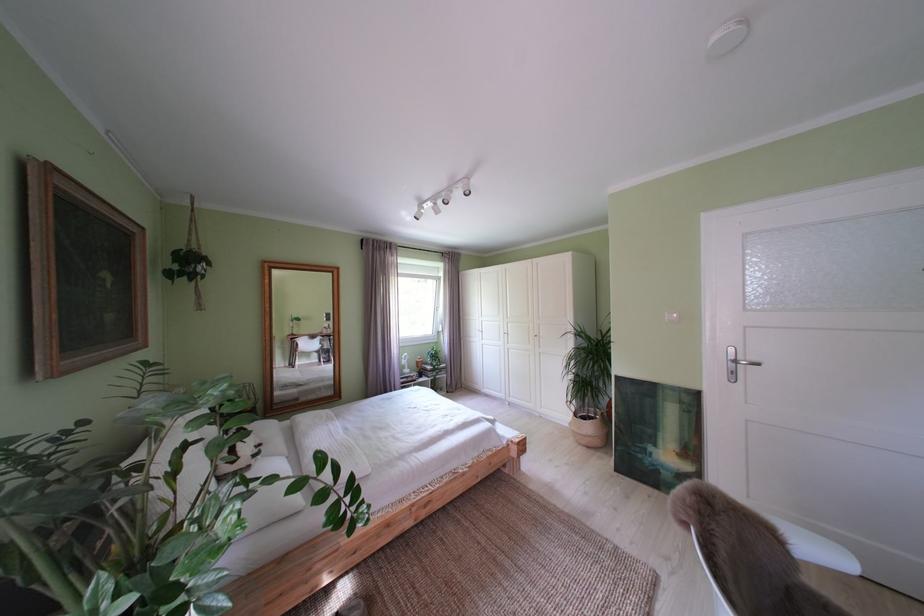
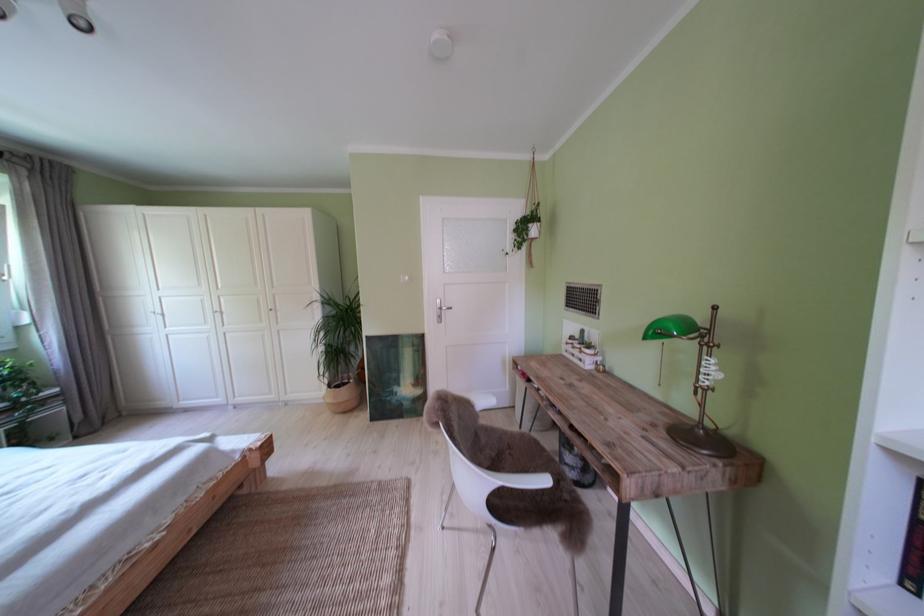
Where in the second image is the point corresponding to (587,419) from the first image?

(341, 392)